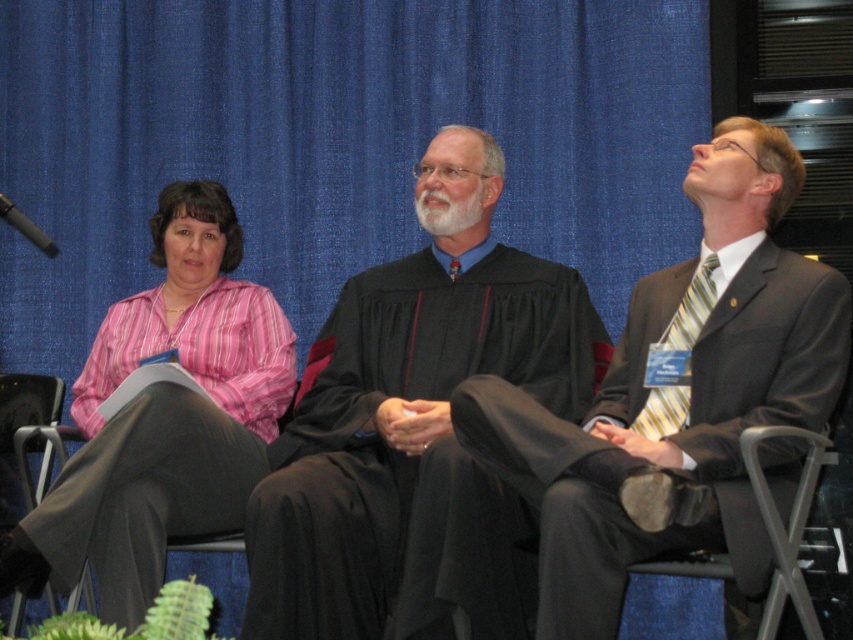
You are organizing a small event and need to place a new decorative item that requires a larger surface area. Based on the scene, which object between the leather seat at lower right and the black plastic microphone at upper left would be more suitable for placing the item?

The leather seat at lower right is larger in size than the black plastic microphone at upper left, so it would be more suitable for placing the decorative item requiring a larger surface area.

Based on the photo, you are organizing a photo shoot and need to ensure that the matte black robe at center and the leather seat at lower right are visible in the frame. Given their sizes, which object should you prioritize positioning closer to the camera to maintain detail?

The matte black robe at center is wider than the leather seat at lower right. To ensure both are visible and maintain detail, prioritize positioning the matte black robe at center closer to the camera since its larger size may require more focus to capture all details clearly.

You are standing in front of the three individuals seated against the blue curtain. There are two points marked in the image. Which point, point (30, 588) or point (44, 250), is closer to you?

Point (30, 588) is closer to you because it is further to the viewer than point (44, 250).